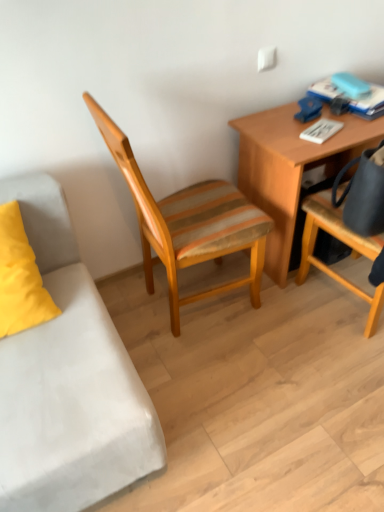
Where is `empty space that is in between woodenchair at center, which is the 1th chair from left to right, and matte black bag at right, arranged as the second chair when viewed from the left`? empty space that is in between woodenchair at center, which is the 1th chair from left to right, and matte black bag at right, arranged as the second chair when viewed from the left is located at coordinates (283, 338).